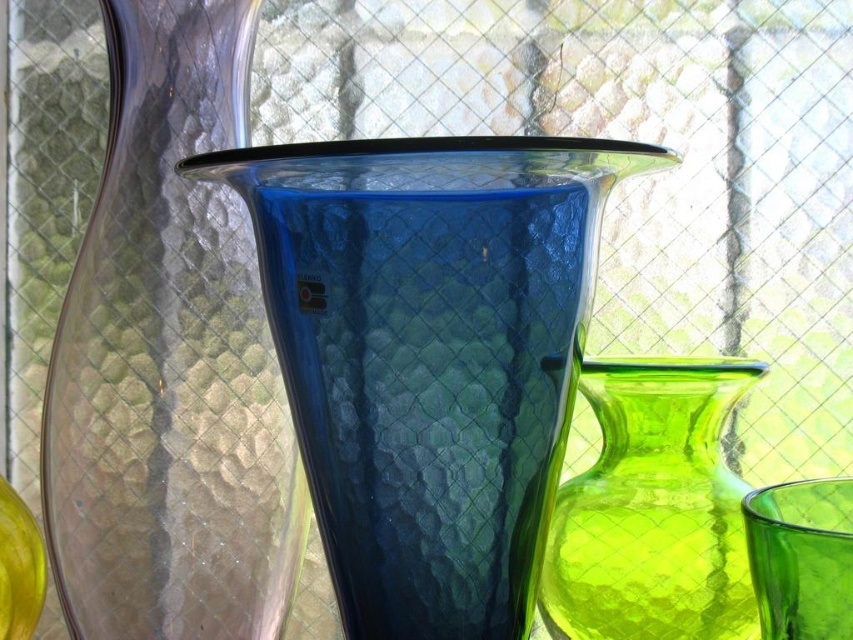
Between point (247, 19) and point (711, 515), which one is positioned in front?

Point (247, 19)

Is point (154, 536) more distant than point (735, 604)?

No, it is not.

Which is behind, point (207, 220) or point (602, 513)?

Positioned behind is point (602, 513).

Where is `transparent glass vase at left`? transparent glass vase at left is located at coordinates (169, 362).

Is blue textured glass pitcher at center bigger than lime green glass vase at right?

Yes, blue textured glass pitcher at center is bigger than lime green glass vase at right.

What do you see at coordinates (430, 355) in the screenshot? I see `blue textured glass pitcher at center` at bounding box center [430, 355].

Is point (343, 472) farther from camera compared to point (635, 488)?

No, it is not.

Image resolution: width=853 pixels, height=640 pixels. In order to click on blue textured glass pitcher at center in this screenshot , I will do (430, 355).

Who is higher up, blue textured glass pitcher at center or transparent glass vase at left?

Positioned higher is transparent glass vase at left.

You are a GUI agent. You are given a task and a screenshot of the screen. Output one action in this format:
    pyautogui.click(x=<x>, y=<y>)
    Task: Click on the blue textured glass pitcher at center
    
    Given the screenshot: What is the action you would take?
    pyautogui.click(x=430, y=355)